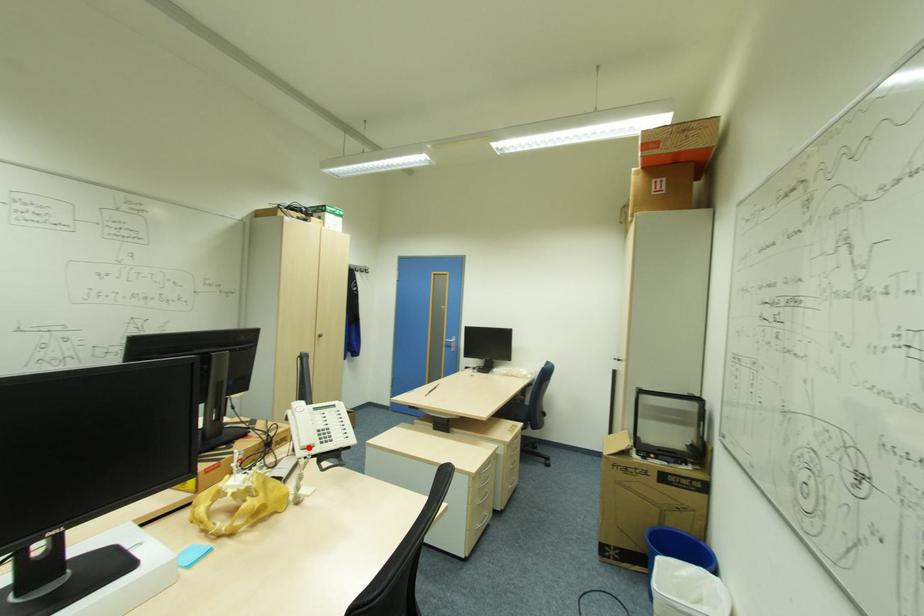
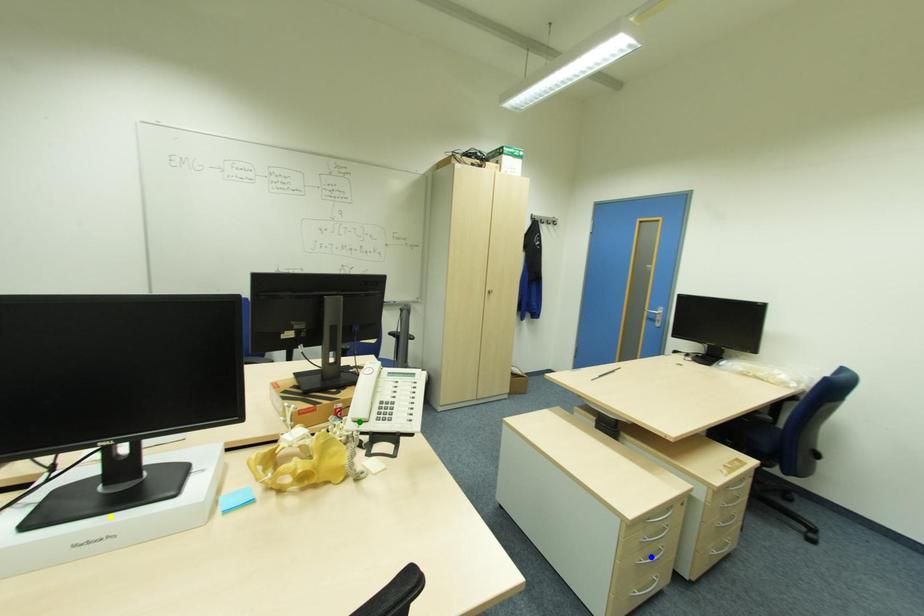
Question: I am providing you with two images of the same scene from different viewpoints. A red point is marked on the first image. You are given multiple points on the second image. Which spot in image 2 lines up with the point in image 1?

Choices:
 (A) yellow point
 (B) blue point
 (C) green point

Answer: (C)